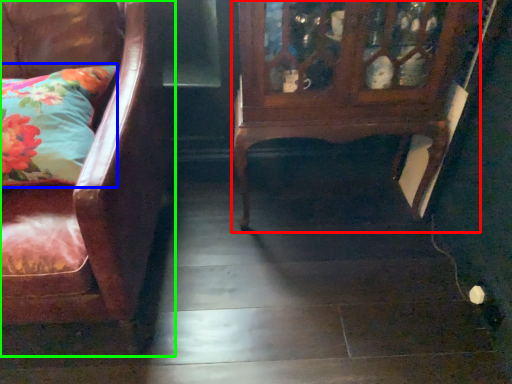
Question: Based on their relative distances, which object is nearer to furniture (highlighted by a red box)? Choose from pillow (highlighted by a blue box) and chair (highlighted by a green box).

Choices:
 (A) pillow
 (B) chair

Answer: (B)